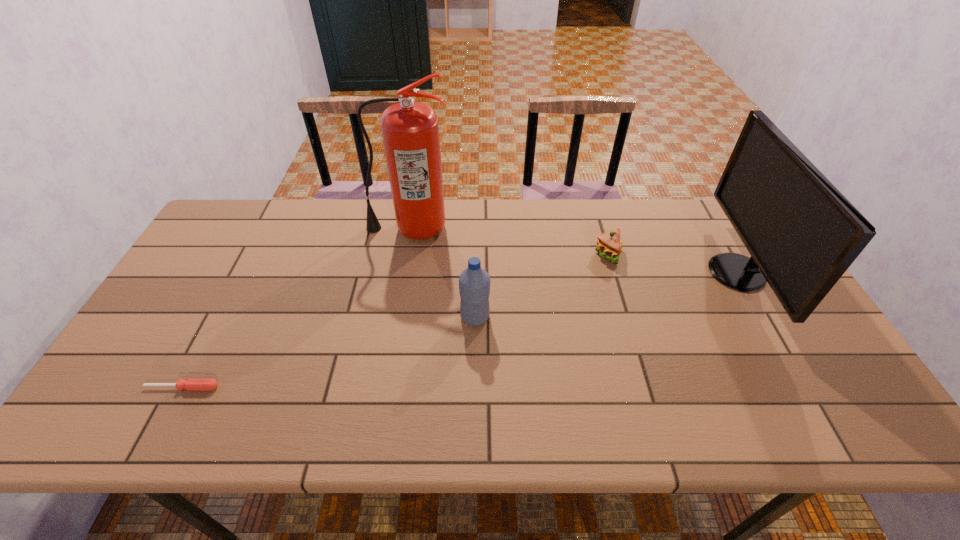
This screenshot has width=960, height=540. I want to click on object situated at the left edge, so click(x=191, y=384).

Image resolution: width=960 pixels, height=540 pixels. Find the location of `object that is at the right edge`. object that is at the right edge is located at coordinates (802, 233).

Find the location of a particular element. object that is at the far right corner is located at coordinates (802, 233).

In the image, there is a desktop. At what (x,y) coordinates should I click in order to perform the action: click on free space at the far edge. Please return your answer as a coordinate pair (x, y). Image resolution: width=960 pixels, height=540 pixels. Looking at the image, I should click on (451, 233).

In the image, there is a desktop. Where is `vacant space at the near edge`? This screenshot has width=960, height=540. vacant space at the near edge is located at coordinates (161, 434).

This screenshot has height=540, width=960. In order to click on vacant position at the left edge of the desktop in this screenshot , I will do 219,265.

In order to click on free space at the far left corner of the desktop in this screenshot , I will do `click(234, 206)`.

Locate an element on the screen. The width and height of the screenshot is (960, 540). free space between the screwdriver and the water bottle is located at coordinates (328, 352).

Locate an element on the screen. The height and width of the screenshot is (540, 960). blank region between the fourth object from left to right and the shortest object is located at coordinates (395, 321).

At what (x,y) coordinates should I click in order to perform the action: click on vacant region between the leftmost object and the sandwich. Please return your answer as a coordinate pair (x, y). Image resolution: width=960 pixels, height=540 pixels. Looking at the image, I should click on (395, 321).